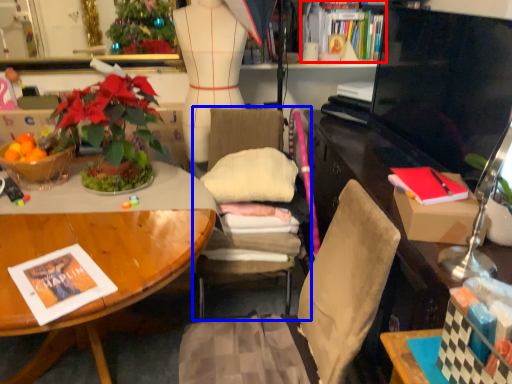
Question: Which object appears farthest to the camera in this image, book (highlighted by a red box) or chair (highlighted by a blue box)?

Choices:
 (A) book
 (B) chair

Answer: (A)